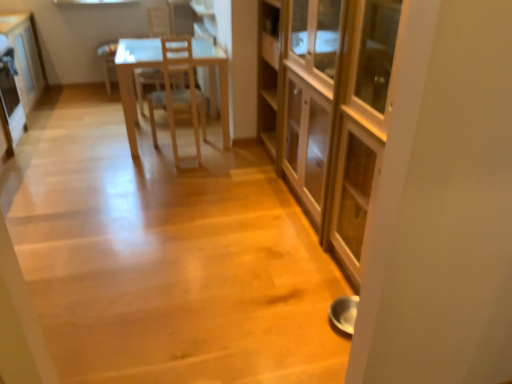
Image resolution: width=512 pixels, height=384 pixels. Find the location of `free point in front of wooden chair at center`. free point in front of wooden chair at center is located at coordinates (169, 173).